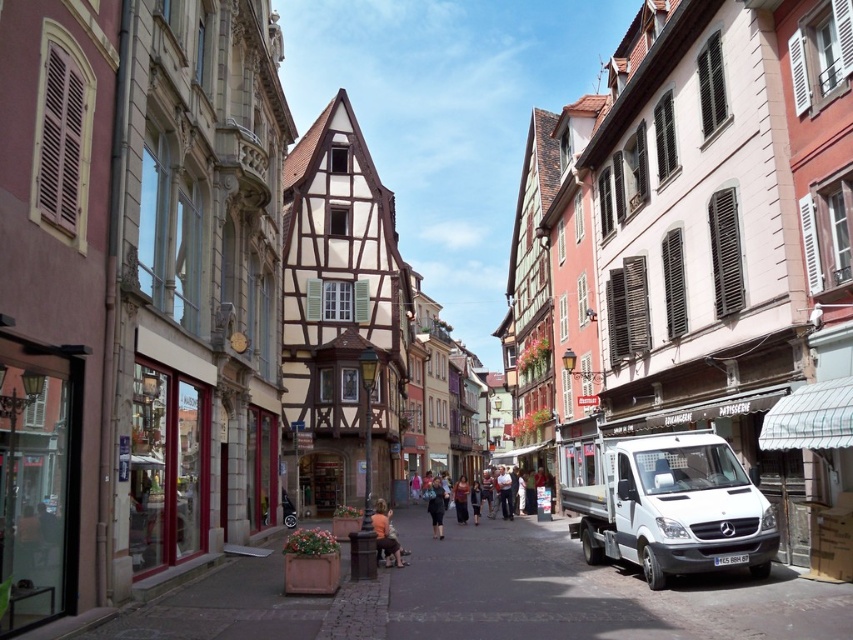
Between white metallic van at lower right and matte black jacket at center, which one appears on the right side from the viewer's perspective?

white metallic van at lower right is more to the right.

The image size is (853, 640). I want to click on white metallic van at lower right, so coord(670,506).

Measure the distance between matte black jacket at center and dark blue jeans at center.

matte black jacket at center is 24.91 meters away from dark blue jeans at center.

Which of these two, matte black jacket at center or dark blue jeans at center, stands shorter?

With less height is matte black jacket at center.

Is point (384, 552) behind point (430, 486)?

No, (384, 552) is closer to viewer.

I want to click on matte black jacket at center, so click(386, 532).

Is point (380, 516) positioned behind point (462, 484)?

No, (380, 516) is closer to viewer.

Which of these two, matte black jacket at center or dark brown leather jacket at center, stands taller?

With more height is dark brown leather jacket at center.

Is point (389, 518) closer to camera compared to point (457, 518)?

Yes, point (389, 518) is in front of point (457, 518).

Locate an element on the screen. matte black jacket at center is located at coordinates (386, 532).